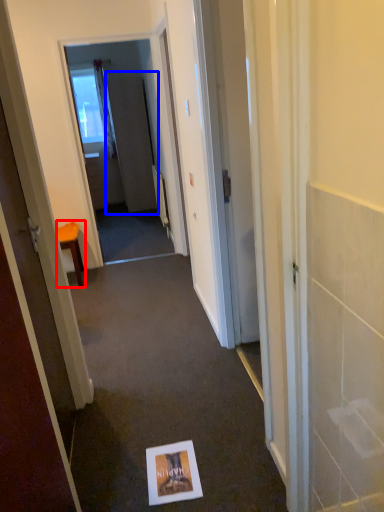
Question: Which point is further to the camera, furniture (highlighted by a red box) or screen door (highlighted by a blue box)?

Choices:
 (A) furniture
 (B) screen door

Answer: (B)